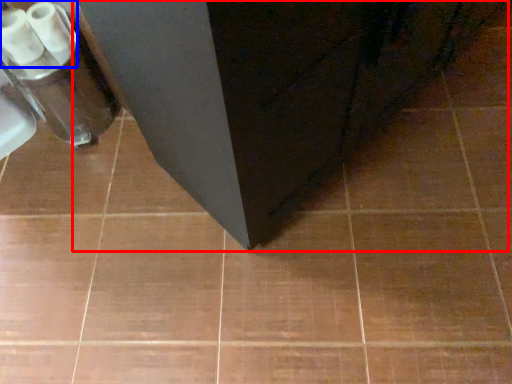
Question: Which point is further to the camera, furniture (highlighted by a red box) or toilet paper (highlighted by a blue box)?

Choices:
 (A) furniture
 (B) toilet paper

Answer: (B)